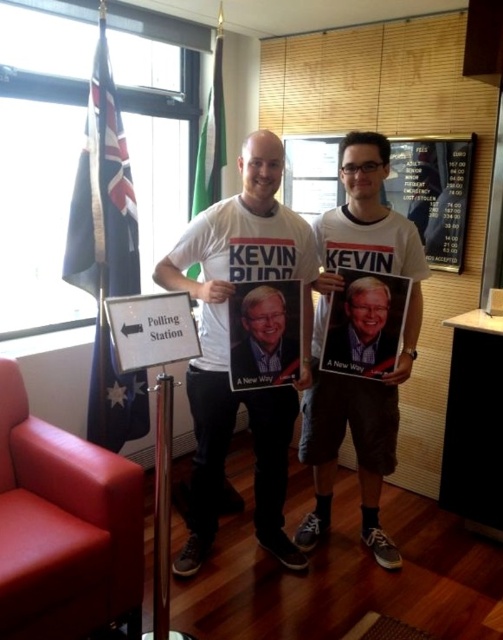
Question: Does matte black poster at center appear on the left side of matte paper poster at center?

Choices:
 (A) yes
 (B) no

Answer: (B)

Question: Which point is closer to the camera?

Choices:
 (A) matte paper poster at center
 (B) matte black poster at center

Answer: (A)

Question: Which point is farther to the camera?

Choices:
 (A) (321, 508)
 (B) (433, 211)
 (C) (284, 344)
 (D) (289, 250)

Answer: (B)

Question: Can you confirm if white cotton t-shirt at center is positioned above white paperboard at center?

Choices:
 (A) no
 (B) yes

Answer: (A)

Question: Which is nearer to the white plastic sign at center?

Choices:
 (A) white paperboard at center
 (B) white t-shirt at center

Answer: (B)

Question: Where is matte black poster at center located in relation to white plastic sign at center in the image?

Choices:
 (A) right
 (B) left

Answer: (A)